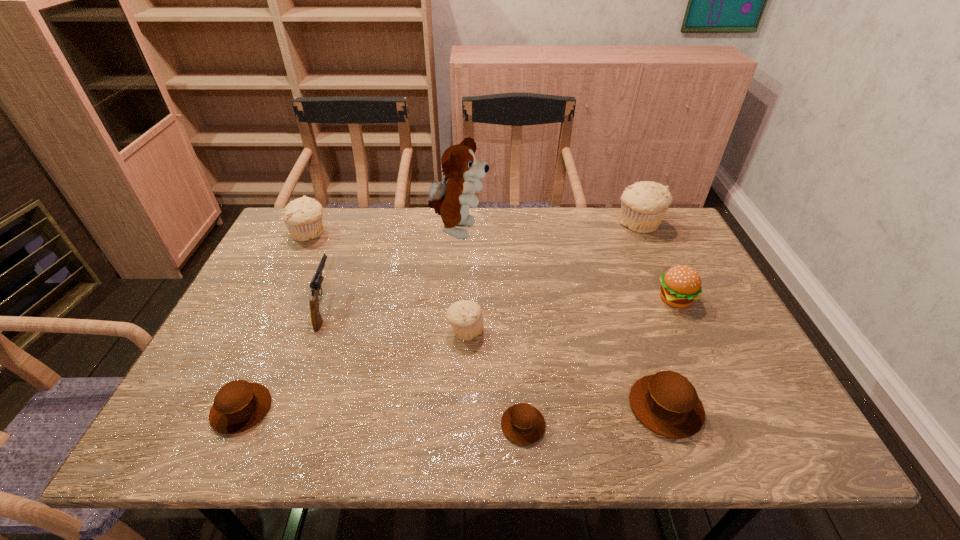
Image resolution: width=960 pixels, height=540 pixels. Find the location of `puppy`. puppy is located at coordinates (452, 200).

Where is `brown puppy`? brown puppy is located at coordinates click(452, 200).

You are a GUI agent. You are given a task and a screenshot of the screen. Output one action in this format:
    pyautogui.click(x=<x>, y=<y>)
    Task: Click on the biggest beige muffin
    The height and width of the screenshot is (540, 960).
    Given the screenshot: What is the action you would take?
    pyautogui.click(x=643, y=204)

This screenshot has height=540, width=960. Find the location of `the eighth shortest object`. the eighth shortest object is located at coordinates (643, 204).

Locate an element on the screen. The height and width of the screenshot is (540, 960). the second tallest muffin is located at coordinates (303, 216).

At what (x,y) coordinates should I click in order to perform the action: click on the second smallest beige muffin. Please return your answer as a coordinate pair (x, y). The height and width of the screenshot is (540, 960). Looking at the image, I should click on (303, 216).

Where is `the third object from left to right`? This screenshot has width=960, height=540. the third object from left to right is located at coordinates (315, 285).

Locate an element on the screen. This screenshot has height=540, width=960. gun is located at coordinates (315, 285).

What are the coordinates of `hamburger` in the screenshot? It's located at (680, 286).

Identify the location of the second beige muffin from left to right. This screenshot has height=540, width=960. (466, 317).